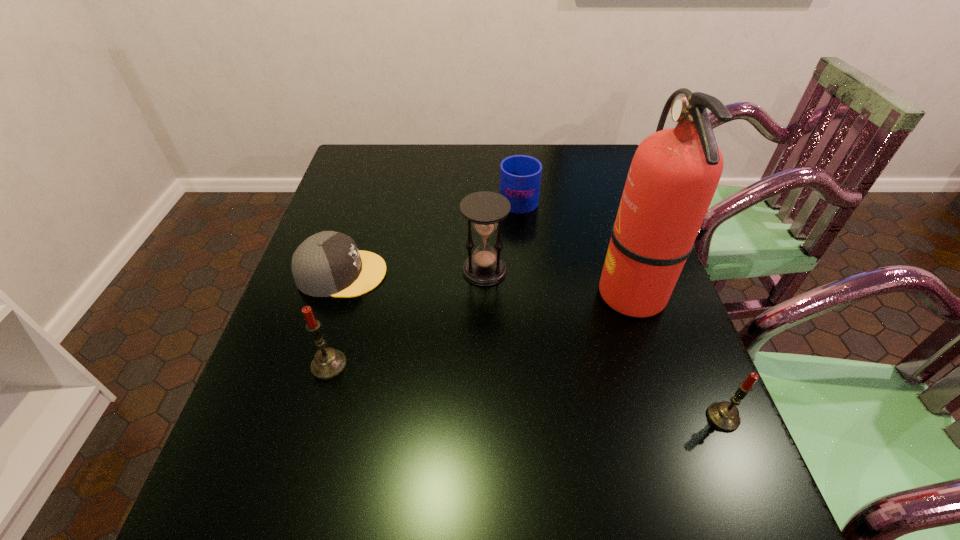
Identify the location of candle at the left edge. Image resolution: width=960 pixels, height=540 pixels. (328, 363).

Identify the location of cap that is at the left edge. (328, 263).

I want to click on candle that is at the right edge, so click(724, 415).

This screenshot has height=540, width=960. Find the location of `fire extinguisher present at the right edge`. fire extinguisher present at the right edge is located at coordinates (674, 174).

The image size is (960, 540). What are the coordinates of `object that is at the near right corner` in the screenshot? It's located at (724, 415).

You are a GUI agent. You are given a task and a screenshot of the screen. Output one action in this format:
    pyautogui.click(x=<x>, y=<y>)
    Task: Click on the free region at the far edge of the desktop
    The image size is (960, 540).
    Given the screenshot: What is the action you would take?
    pyautogui.click(x=441, y=150)

In the image, there is a desktop. Identify the location of vacant space at the near edge. The width and height of the screenshot is (960, 540). (518, 456).

Find the location of a particular element. The width and height of the screenshot is (960, 540). vacant space at the left edge is located at coordinates (268, 345).

The width and height of the screenshot is (960, 540). Identify the location of vacant point at the right edge. (641, 416).

Identify the location of vacant space at the far left corner of the desktop. (388, 176).